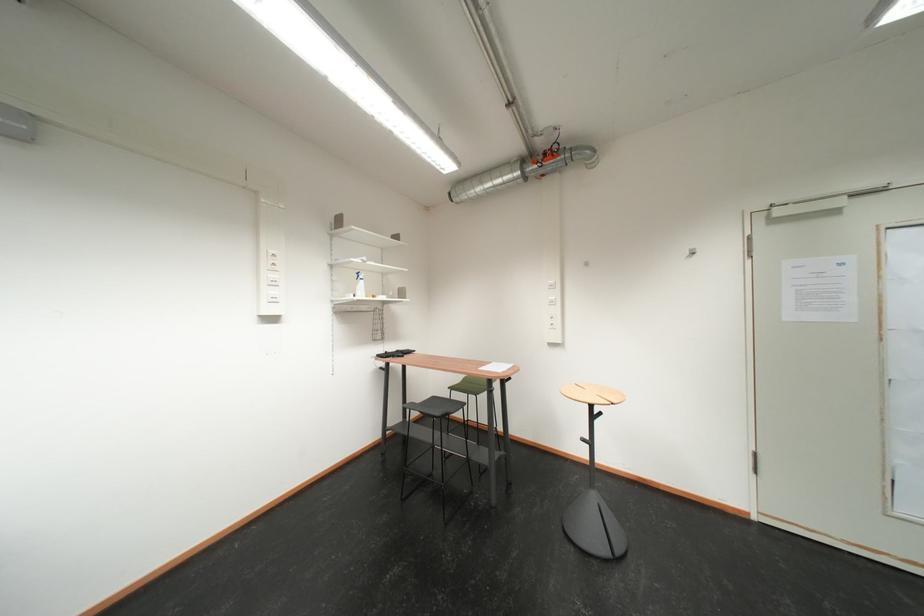
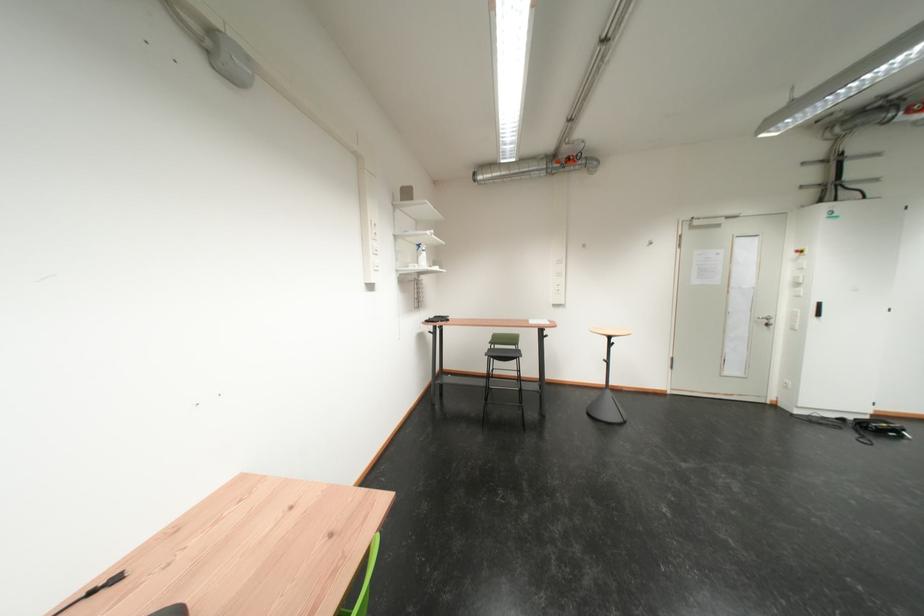
Question: The images are taken continuously from a first-person perspective. In which direction are you moving?

Choices:
 (A) Left
 (B) Right
 (C) Forward
 (D) Backward

Answer: (A)